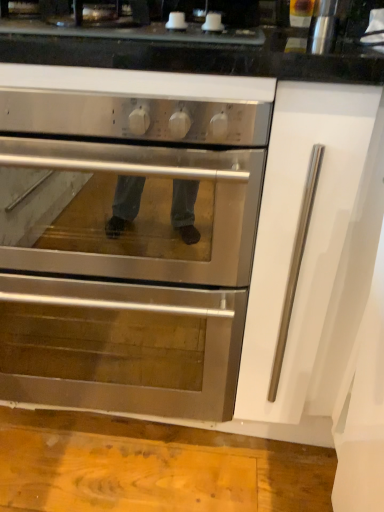
Measure the distance between metallic cylindrical container at upper right and camera.

metallic cylindrical container at upper right and camera are 30.00 inches apart.

Locate an element on the screen. The width and height of the screenshot is (384, 512). satin black cooktop at upper center is located at coordinates (132, 46).

The image size is (384, 512). Identify the location of stainless steel oven at center. (125, 250).

The width and height of the screenshot is (384, 512). Identify the location of metallic cylindrical container at upper right. (x=323, y=27).

From a real-world perspective, which object rests below the other?

From a 3D spatial view, stainless steel oven at center is below.

Does stainless steel oven at center have a lesser width compared to metallic cylindrical container at upper right?

No.

Is stainless steel oven at center not close to metallic cylindrical container at upper right?

They are positioned close to each other.

Image resolution: width=384 pixels, height=512 pixels. What are the coordinates of `oven in front of the metallic cylindrical container at upper right` in the screenshot? It's located at 125,250.

Can you tell me how much metallic cylindrical container at upper right and satin black cooktop at upper center differ in facing direction?

The angle between the facing direction of metallic cylindrical container at upper right and the facing direction of satin black cooktop at upper center is 0.00809 degrees.

Considering the points (320, 4) and (140, 41), which point is behind, point (320, 4) or point (140, 41)?

The point (320, 4) is farther.

Is metallic cylindrical container at upper right further to the viewer compared to satin black cooktop at upper center?

Yes, it is.

Between metallic cylindrical container at upper right and satin black cooktop at upper center, which one has smaller size?

metallic cylindrical container at upper right is smaller.

From a real-world perspective, is metallic cylindrical container at upper right under stainless steel oven at center?

Actually, metallic cylindrical container at upper right is physically above stainless steel oven at center in the real world.

Could you measure the distance between metallic cylindrical container at upper right and stainless steel oven at center?

metallic cylindrical container at upper right and stainless steel oven at center are 26.86 inches apart from each other.

Who is more distant, metallic cylindrical container at upper right or stainless steel oven at center?

metallic cylindrical container at upper right is further from the camera.

Is metallic cylindrical container at upper right bigger than stainless steel oven at center?

Incorrect, metallic cylindrical container at upper right is not larger than stainless steel oven at center.

Between satin black cooktop at upper center and metallic cylindrical container at upper right, which one has smaller size?

metallic cylindrical container at upper right.

In the scene shown: Is satin black cooktop at upper center not near metallic cylindrical container at upper right?

No.

Can we say satin black cooktop at upper center lies outside metallic cylindrical container at upper right?

Yes, satin black cooktop at upper center is not within metallic cylindrical container at upper right.

How far apart are satin black cooktop at upper center and metallic cylindrical container at upper right?

satin black cooktop at upper center and metallic cylindrical container at upper right are 13.60 inches apart.

From the image's perspective, which one is positioned lower, satin black cooktop at upper center or stainless steel oven at center?

stainless steel oven at center, from the image's perspective.

Can you tell me how much satin black cooktop at upper center and stainless steel oven at center differ in facing direction?

The angular difference between satin black cooktop at upper center and stainless steel oven at center is 0.000652 degrees.

Does satin black cooktop at upper center have a greater height compared to stainless steel oven at center?

No, satin black cooktop at upper center is not taller than stainless steel oven at center.

Is satin black cooktop at upper center oriented away from stainless steel oven at center?

No, satin black cooktop at upper center is not facing the opposite direction of stainless steel oven at center.

Is stainless steel oven at center spatially inside satin black cooktop at upper center, or outside of it?

stainless steel oven at center is not enclosed by satin black cooktop at upper center.

Does stainless steel oven at center have a greater width compared to satin black cooktop at upper center?

A: Indeed, stainless steel oven at center has a greater width compared to satin black cooktop at upper center.

From a real-world perspective, is stainless steel oven at center physically above satin black cooktop at upper center?

No, from a real-world perspective, stainless steel oven at center is not over satin black cooktop at upper center

Which is more to the left, stainless steel oven at center or satin black cooktop at upper center?

Answer: stainless steel oven at center is more to the left.

This screenshot has height=512, width=384. In order to click on appliance located above the stainless steel oven at center (from the image's perspective) in this screenshot , I will do `click(323, 27)`.

Where is `gas stove that is under the metallic cylindrical container at upper right (from a real-world perspective)`? The image size is (384, 512). gas stove that is under the metallic cylindrical container at upper right (from a real-world perspective) is located at coordinates (132, 46).

From the image, which object appears to be farther from stainless steel oven at center, metallic cylindrical container at upper right or satin black cooktop at upper center?

Based on the image, metallic cylindrical container at upper right appears to be further to stainless steel oven at center.

Based on their spatial positions, is stainless steel oven at center or metallic cylindrical container at upper right closer to satin black cooktop at upper center?

The object closer to satin black cooktop at upper center is metallic cylindrical container at upper right.

From the picture: Based on their spatial positions, is stainless steel oven at center or satin black cooktop at upper center closer to metallic cylindrical container at upper right?

satin black cooktop at upper center is positioned closer to the anchor metallic cylindrical container at upper right.

Which object lies nearer to the anchor point metallic cylindrical container at upper right, satin black cooktop at upper center or stainless steel oven at center?

satin black cooktop at upper center is positioned closer to the anchor metallic cylindrical container at upper right.

From the image, which object appears to be farther from stainless steel oven at center, satin black cooktop at upper center or metallic cylindrical container at upper right?

metallic cylindrical container at upper right is positioned further to the anchor stainless steel oven at center.

Looking at the image, which one is located further to satin black cooktop at upper center, metallic cylindrical container at upper right or stainless steel oven at center?

The object further to satin black cooktop at upper center is stainless steel oven at center.

Find the location of a particular element. This screenshot has height=512, width=384. gas stove between metallic cylindrical container at upper right and stainless steel oven at center vertically is located at coordinates (132, 46).